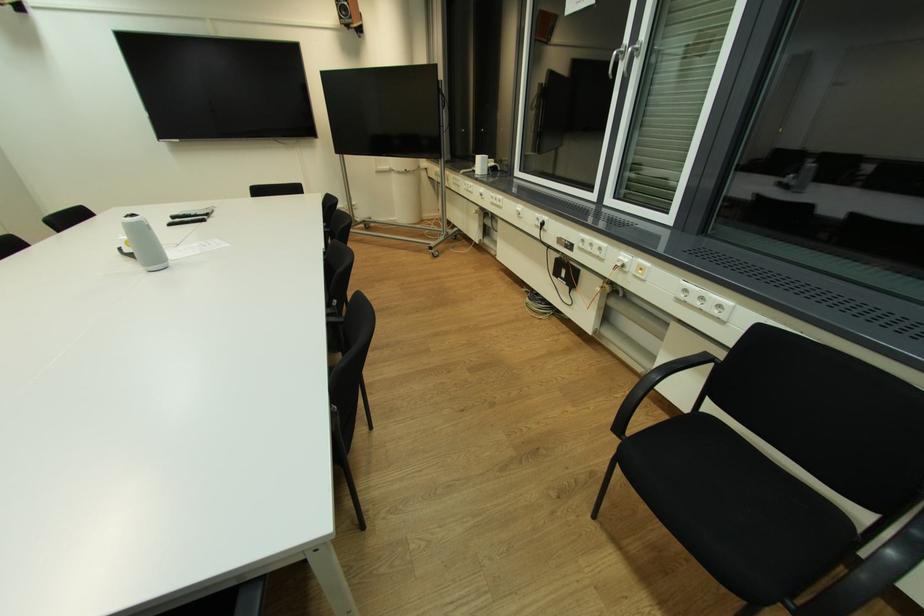
The location [349,15] corresponds to which object?

This point indicates the grey conference speaker.